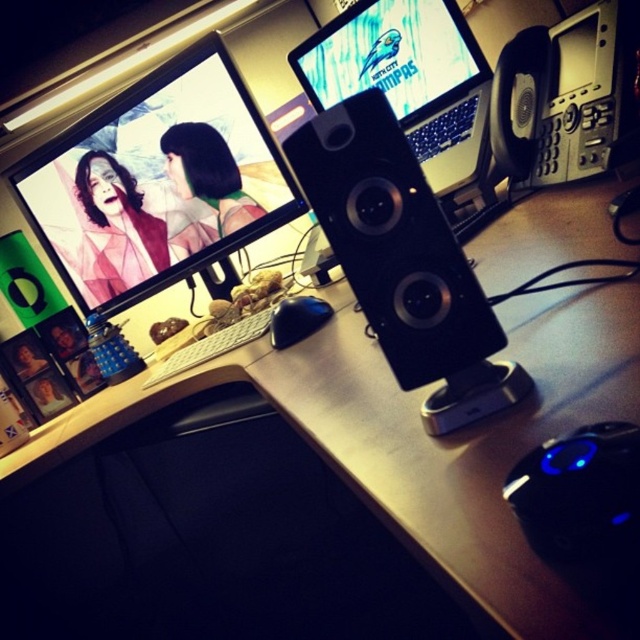
Question: Which of the following is the closest to the observer?

Choices:
 (A) (284, 326)
 (B) (320, 128)

Answer: (B)

Question: Which point is farther to the camera?

Choices:
 (A) [412, 52]
 (B) [182, 365]
 (C) [444, 326]
 (D) [83, 144]

Answer: (D)

Question: Can you confirm if white plastic keyboard at center is bigger than black matte mouse at center?

Choices:
 (A) no
 (B) yes

Answer: (B)

Question: Which point is closer to the camera?

Choices:
 (A) black plastic speaker at center
 (B) black matte mouse at center

Answer: (A)

Question: Does white plastic keyboard at center appear on the right side of black matte mouse at center?

Choices:
 (A) no
 (B) yes

Answer: (A)

Question: Can you confirm if white plastic keyboard at center is positioned below black matte mouse at center?

Choices:
 (A) yes
 (B) no

Answer: (A)